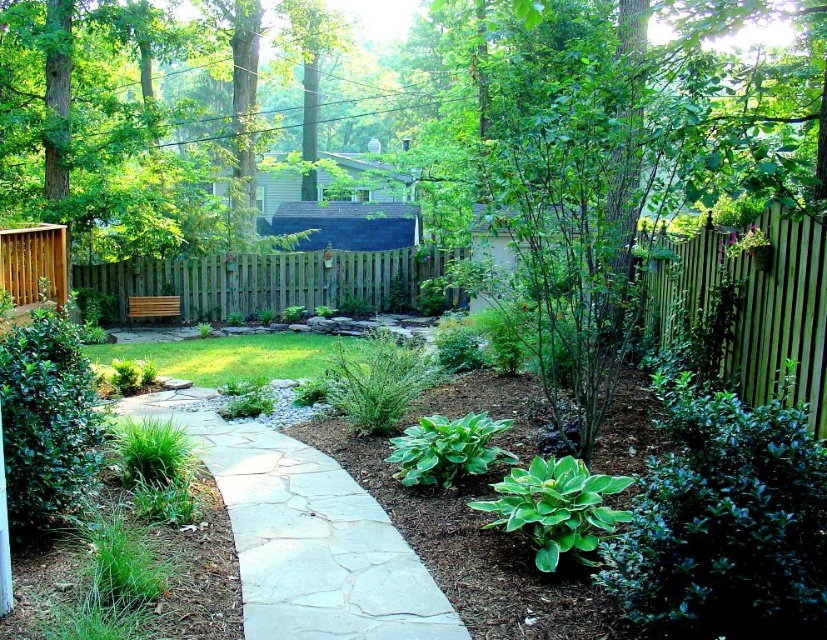
Does natural stone pathway at center appear under brown wood fence at center?

Yes.

Is natural stone pathway at center above brown wood fence at center?

No.

The height and width of the screenshot is (640, 827). Find the location of `natural stone pathway at center`. natural stone pathway at center is located at coordinates (304, 536).

Is green wooden fence at right in front of brown wood fence at center?

That is True.

Does green wooden fence at right have a greater width compared to brown wood fence at center?

No, green wooden fence at right is not wider than brown wood fence at center.

Is point (739, 378) closer to camera compared to point (434, 273)?

That is True.

The image size is (827, 640). I want to click on green wooden fence at right, so click(x=753, y=307).

Between natural stone pathway at center and green wooden fence at right, which one appears on the right side from the viewer's perspective?

green wooden fence at right is more to the right.

Is natural stone pathway at center to the right of green wooden fence at right from the viewer's perspective?

In fact, natural stone pathway at center is to the left of green wooden fence at right.

Image resolution: width=827 pixels, height=640 pixels. What do you see at coordinates (304, 536) in the screenshot?
I see `natural stone pathway at center` at bounding box center [304, 536].

I want to click on natural stone pathway at center, so click(304, 536).